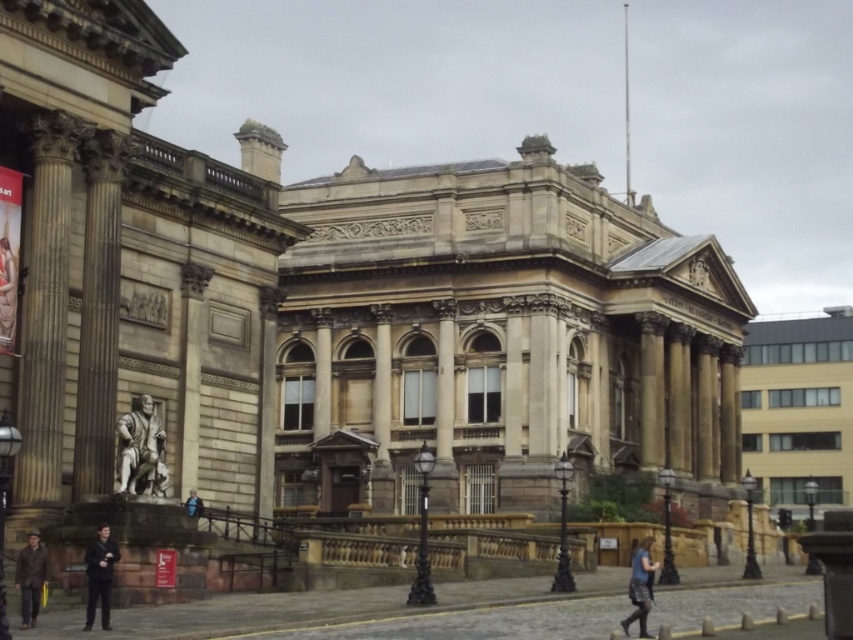
You are standing at the entrance of the grand neoclassical building and want to walk towards the statue in front of the building. There are two points marked on the ground in front of you at coordinates point (148, 460) and point (119, 560). Which point is closer to the statue?

Point (119, 560) is closer to the statue because it is in front of point (148, 460), which is behind it.